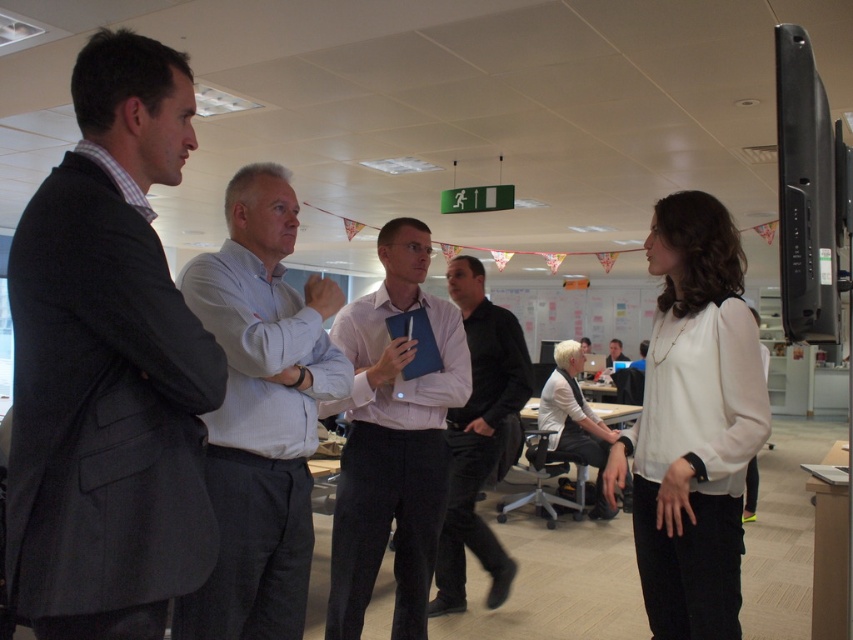
You are organizing a photoshoot and need to arrange two models wearing the light pink shirt at center and the white matte blouse at center. Based on the scene description, which model should stand in front to ensure both are visible in the photo?

The light pink shirt at center is taller than the white matte blouse at center, so the model wearing the white matte blouse at center should stand in front to ensure both are visible.